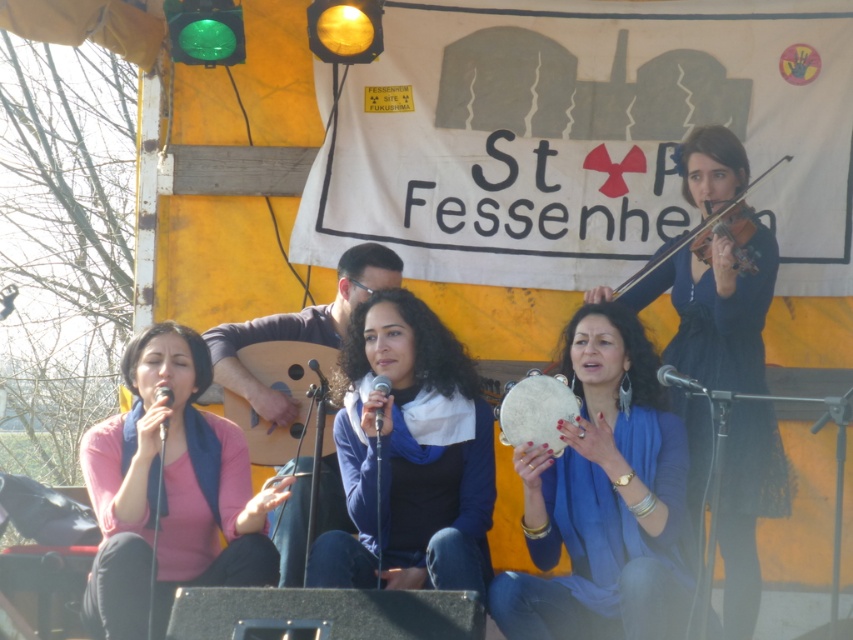
Question: Which point appears farthest from the camera in this image?

Choices:
 (A) (167, 401)
 (B) (379, 388)
 (C) (683, 378)

Answer: (A)

Question: Is blue fabric scarf at center further to the viewer compared to matte black microphone at lower left?

Choices:
 (A) yes
 (B) no

Answer: (B)

Question: Considering the real-world distances, which object is closest to the metallic silver microphone at center?

Choices:
 (A) matte black microphone at lower left
 (B) blue fabric tambourine at center
 (C) wooden acoustic guitar at center
 (D) metallic silver microphone at lower right

Answer: (C)

Question: Which object appears farthest from the camera in this image?

Choices:
 (A) metallic silver microphone at center
 (B) matte black microphone at lower left
 (C) blue fabric tambourine at center

Answer: (B)

Question: Observing the image, what is the correct spatial positioning of pink matte sweater at left in reference to wooden violin at upper right?

Choices:
 (A) above
 (B) below

Answer: (B)

Question: From the image, what is the correct spatial relationship of blue fabric tambourine at center in relation to pink matte sweater at left?

Choices:
 (A) below
 (B) above

Answer: (B)